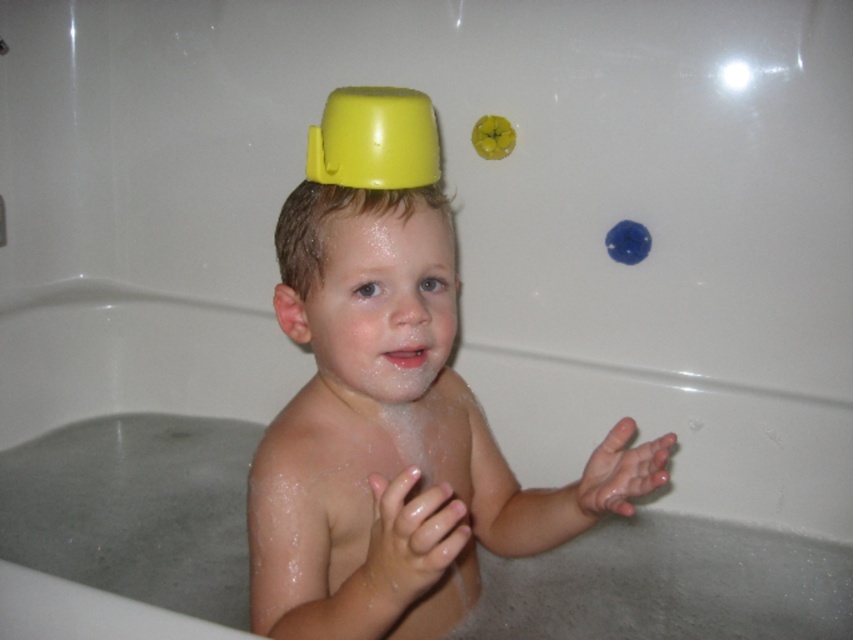
Can you confirm if yellow plastic cup at upper center is bigger than yellow matte cup at center?

Correct, yellow plastic cup at upper center is larger in size than yellow matte cup at center.

Can you confirm if yellow plastic cup at upper center is wider than yellow matte cup at center?

Yes.

Which is in front, point (392, 257) or point (376, 252)?

Positioned in front is point (376, 252).

What are the coordinates of `yellow plastic cup at upper center` in the screenshot? It's located at click(x=392, y=404).

Is point (294, 403) less distant than point (407, 376)?

No, it is behind (407, 376).

Between shiny skin at center and yellow matte cup at center, which one has more height?

shiny skin at center is taller.

Who is more distant from viewer, [344,406] or [434,365]?

The point [344,406] is more distant.

Find the location of a particular element. The height and width of the screenshot is (640, 853). shiny skin at center is located at coordinates point(367,512).

Who is more distant from viewer, [416,189] or [506,145]?

Point [506,145]

Does point (364, 388) come farther from viewer compared to point (498, 124)?

No, (364, 388) is in front of (498, 124).

What do you see at coordinates (369, 285) in the screenshot? I see `yellow matte cup at center` at bounding box center [369, 285].

Locate an element on the screen. yellow matte cup at center is located at coordinates (369, 285).